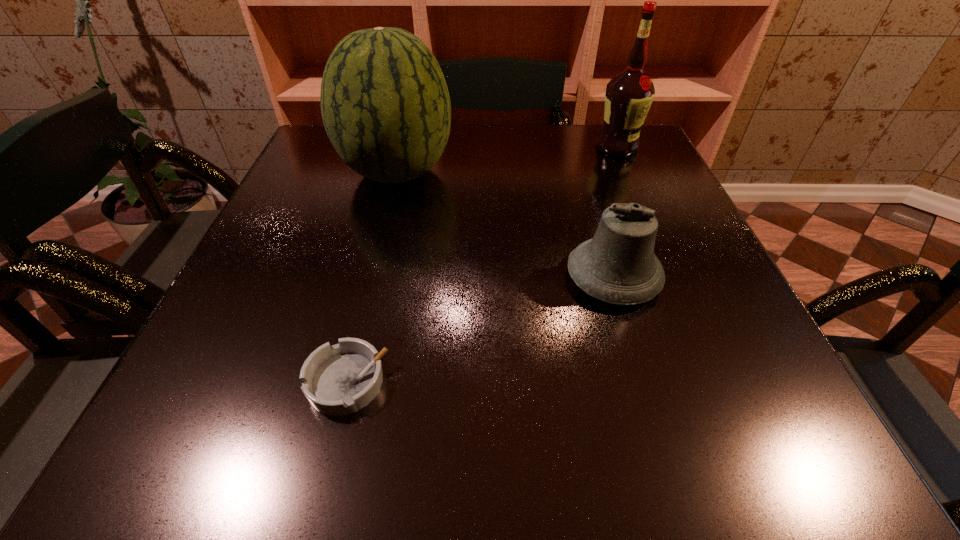
This screenshot has height=540, width=960. Identify the location of free space at the left edge of the desktop. (273, 265).

Where is `vacant position at the right edge of the desktop`? vacant position at the right edge of the desktop is located at coordinates (653, 172).

Where is `vacant space at the near left corner of the desktop`? The height and width of the screenshot is (540, 960). vacant space at the near left corner of the desktop is located at coordinates click(263, 445).

This screenshot has width=960, height=540. What are the coordinates of `free space between the ashtray and the third farthest object` in the screenshot? It's located at (480, 329).

I want to click on free spot between the alcohol and the watermelon, so click(507, 159).

Locate an element on the screen. unoccupied position between the ashtray and the watermelon is located at coordinates (372, 276).

Locate an element on the screen. Image resolution: width=960 pixels, height=540 pixels. vacant space in between the alcohol and the shortest object is located at coordinates (482, 264).

Locate an element on the screen. vacant space that is in between the nearest object and the watermelon is located at coordinates (372, 276).

At what (x,y) coordinates should I click in order to perform the action: click on empty space between the bell and the ashtray. Please return your answer as a coordinate pair (x, y). Looking at the image, I should click on (480, 329).

Identify the location of unoccupied position between the third tallest object and the ashtray. Image resolution: width=960 pixels, height=540 pixels. (480, 329).